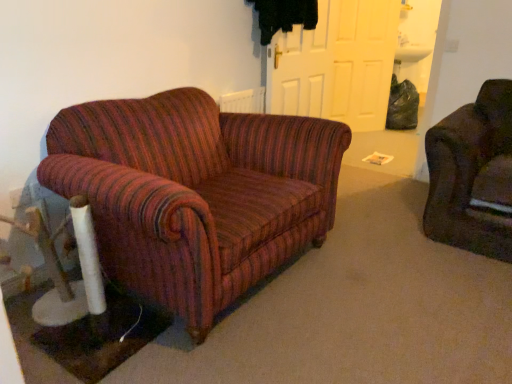
Find the location of a particular element. This screenshot has width=512, height=384. white matte door at upper center, the 2th door positioned from the front is located at coordinates (336, 64).

The height and width of the screenshot is (384, 512). What do you see at coordinates (336, 64) in the screenshot?
I see `white matte door at upper center, the first door from the right` at bounding box center [336, 64].

What is the approximate height of white matte door at upper center, arranged as the 1th door when viewed from the back?

white matte door at upper center, arranged as the 1th door when viewed from the back, is 1.38 meters in height.

This screenshot has height=384, width=512. What do you see at coordinates (302, 67) in the screenshot? I see `white matte door at center, arranged as the second door when viewed from the right` at bounding box center [302, 67].

Where is `white matte door at center, the first door in the left-to-right sequence`? white matte door at center, the first door in the left-to-right sequence is located at coordinates (302, 67).

Where is `white matte door at upper center, which appears as the second door when viewed from the left`? The image size is (512, 384). white matte door at upper center, which appears as the second door when viewed from the left is located at coordinates (336, 64).

Considering the relative positions of white matte door at upper center, arranged as the 1th door when viewed from the back, and white matte door at center, which appears as the second door when viewed from the back, in the image provided, is white matte door at upper center, arranged as the 1th door when viewed from the back, to the left of white matte door at center, which appears as the second door when viewed from the back, from the viewer's perspective?

No.

In the image, is white matte door at upper center, the 2th door positioned from the front, positioned in front of or behind white matte door at center, the first door in the left-to-right sequence?

Clearly, white matte door at upper center, the 2th door positioned from the front, is behind white matte door at center, the first door in the left-to-right sequence.

Does point (302, 100) come closer to viewer compared to point (303, 74)?

No, it is behind (303, 74).

In the scene shown: From the image's perspective, who appears lower, white matte door at upper center, arranged as the 1th door when viewed from the back, or white matte door at center, the first door in the left-to-right sequence?

white matte door at center, the first door in the left-to-right sequence, appears lower in the image.

Based on the photo, from a real-world perspective, is white matte door at upper center, arranged as the 1th door when viewed from the back, located beneath white matte door at center, which is the first door from front to back?

Yes, from a real-world perspective, white matte door at upper center, arranged as the 1th door when viewed from the back, is beneath white matte door at center, which is the first door from front to back.

Considering the sizes of objects white matte door at upper center, arranged as the 1th door when viewed from the back, and white matte door at center, the first door in the left-to-right sequence, in the image provided, who is wider, white matte door at upper center, arranged as the 1th door when viewed from the back, or white matte door at center, the first door in the left-to-right sequence,?

white matte door at upper center, arranged as the 1th door when viewed from the back.

In terms of height, does white matte door at upper center, arranged as the 1th door when viewed from the back, look taller or shorter compared to white matte door at center, the first door in the left-to-right sequence?

white matte door at upper center, arranged as the 1th door when viewed from the back, is taller than white matte door at center, the first door in the left-to-right sequence.

Does white matte door at upper center, arranged as the 1th door when viewed from the back, have a larger size compared to white matte door at center, which appears as the second door when viewed from the back?

Correct, white matte door at upper center, arranged as the 1th door when viewed from the back, is larger in size than white matte door at center, which appears as the second door when viewed from the back.

Is white matte door at center, which appears as the second door when viewed from the back, located within white matte door at upper center, the first door from the right?

That's incorrect, white matte door at center, which appears as the second door when viewed from the back, is not inside white matte door at upper center, the first door from the right.

Is white matte door at upper center, the first door from the right, touching white matte door at center, the first door in the left-to-right sequence?

No, white matte door at upper center, the first door from the right, is not touching white matte door at center, the first door in the left-to-right sequence.

Is white matte door at center, which is the first door from front to back, at the back of white matte door at upper center, the 2th door positioned from the front?

No.

What's the angular difference between white matte door at upper center, the first door from the right, and white matte door at center, which is the first door from front to back,'s facing directions?

The angle between the facing direction of white matte door at upper center, the first door from the right, and the facing direction of white matte door at center, which is the first door from front to back, is 29.9 degrees.

How much distance is there between white matte door at upper center, which appears as the second door when viewed from the left, and white matte door at center, which is the first door from front to back?

white matte door at upper center, which appears as the second door when viewed from the left, is 1.17 meters away from white matte door at center, which is the first door from front to back.

Where is `door positioned vertically above the white matte door at upper center, arranged as the 1th door when viewed from the back (from a real-world perspective)`? door positioned vertically above the white matte door at upper center, arranged as the 1th door when viewed from the back (from a real-world perspective) is located at coordinates (302, 67).

Is white matte door at center, the first door in the left-to-right sequence, to the left of white matte door at upper center, the first door from the right, from the viewer's perspective?

Yes.

Does white matte door at center, arranged as the second door when viewed from the right, come behind white matte door at upper center, the 2th door positioned from the front?

That is False.

Is point (304, 53) positioned before point (376, 98)?

Yes, point (304, 53) is closer to viewer.

From the image's perspective, is white matte door at center, which is the first door from front to back, on top of white matte door at upper center, the 2th door positioned from the front?

No, from the image's perspective, white matte door at center, which is the first door from front to back, is not over white matte door at upper center, the 2th door positioned from the front.

From a real-world perspective, which object stands above the other?

white matte door at center, arranged as the second door when viewed from the right, is physically above.

Between white matte door at center, which appears as the second door when viewed from the back, and white matte door at upper center, which appears as the second door when viewed from the left, which one has larger width?

white matte door at upper center, which appears as the second door when viewed from the left.

Considering the sizes of white matte door at center, which appears as the second door when viewed from the back, and white matte door at upper center, arranged as the 1th door when viewed from the back, in the image, is white matte door at center, which appears as the second door when viewed from the back, taller or shorter than white matte door at upper center, arranged as the 1th door when viewed from the back,?

Clearly, white matte door at center, which appears as the second door when viewed from the back, is shorter compared to white matte door at upper center, arranged as the 1th door when viewed from the back.

Can you confirm if white matte door at center, the first door in the left-to-right sequence, is bigger than white matte door at upper center, arranged as the 1th door when viewed from the back?

No, white matte door at center, the first door in the left-to-right sequence, is not bigger than white matte door at upper center, arranged as the 1th door when viewed from the back.

Is white matte door at upper center, which appears as the second door when viewed from the left, completely or partially inside white matte door at center, the first door in the left-to-right sequence?

Definitely not — white matte door at upper center, which appears as the second door when viewed from the left, is not inside white matte door at center, the first door in the left-to-right sequence.

Are white matte door at center, which appears as the second door when viewed from the back, and white matte door at upper center, arranged as the 1th door when viewed from the back, located far from each other?

Yes.

Is white matte door at center, the first door in the left-to-right sequence, positioned with its back to white matte door at upper center, the 2th door positioned from the front?

No, white matte door at upper center, the 2th door positioned from the front, is not at the back of white matte door at center, the first door in the left-to-right sequence.

Looking at this image, measure the distance between white matte door at center, which is the first door from front to back, and white matte door at upper center, the 2th door positioned from the front.

white matte door at center, which is the first door from front to back, is 1.17 meters from white matte door at upper center, the 2th door positioned from the front.

Find the location of a particular element. The image size is (512, 384). door that appears in front of the white matte door at upper center, the first door from the right is located at coordinates (302, 67).

Identify the location of door above the white matte door at upper center, which appears as the second door when viewed from the left (from a real-world perspective). Image resolution: width=512 pixels, height=384 pixels. (302, 67).

Locate an element on the screen. Image resolution: width=512 pixels, height=384 pixels. door that appears in front of the white matte door at upper center, arranged as the 1th door when viewed from the back is located at coordinates (302, 67).